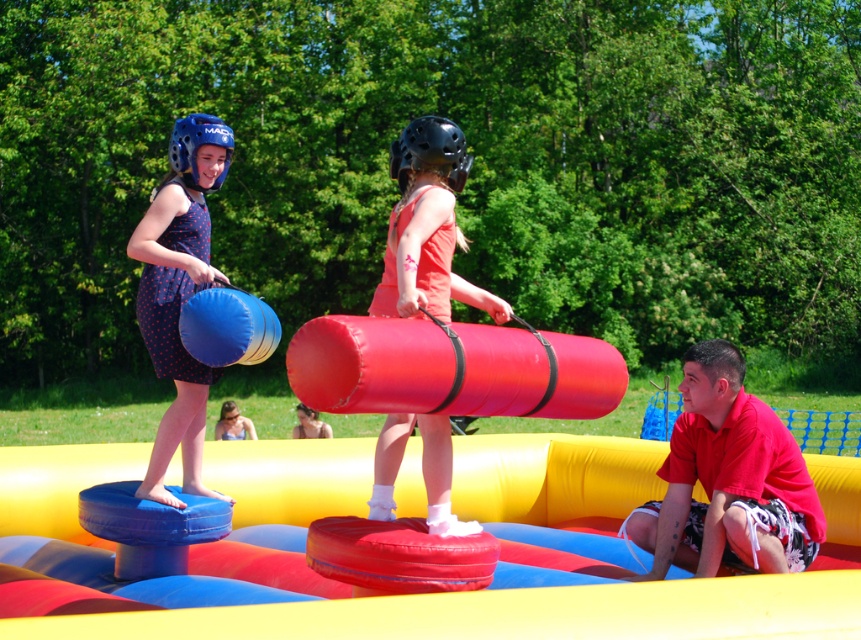
Question: Which of the following is the farthest from the observer?

Choices:
 (A) (314, 422)
 (B) (804, 476)
 (C) (240, 416)
 (D) (228, 129)

Answer: (C)

Question: Does red cotton shirt at lower right appear over smooth pink helmet at upper center?

Choices:
 (A) no
 (B) yes

Answer: (B)

Question: Is matte red cylinder at center above black matte helmet at center?

Choices:
 (A) yes
 (B) no

Answer: (B)

Question: Observing the image, what is the correct spatial positioning of matte red cylinder at center in reference to black matte helmet at center?

Choices:
 (A) below
 (B) above

Answer: (A)

Question: Based on their relative distances, which object is nearer to the black matte helmet at center?

Choices:
 (A) red cotton shirt at lower right
 (B) matte red cylinder at center

Answer: (B)

Question: Which object is farther from the camera taking this photo?

Choices:
 (A) blue dotted dress at upper left
 (B) smooth pink helmet at upper center
 (C) black matte helmet at center
 (D) matte red cylinder at center

Answer: (B)